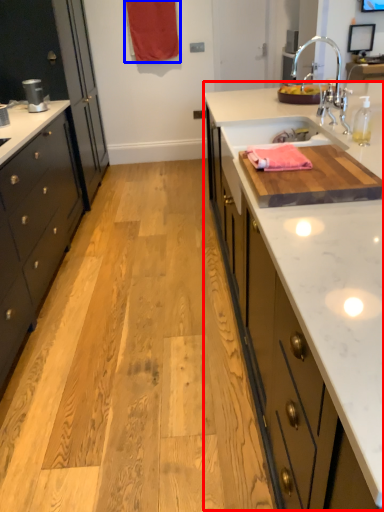
Question: Which object is closer to the camera taking this photo, countertop (highlighted by a red box) or curtain (highlighted by a blue box)?

Choices:
 (A) countertop
 (B) curtain

Answer: (A)